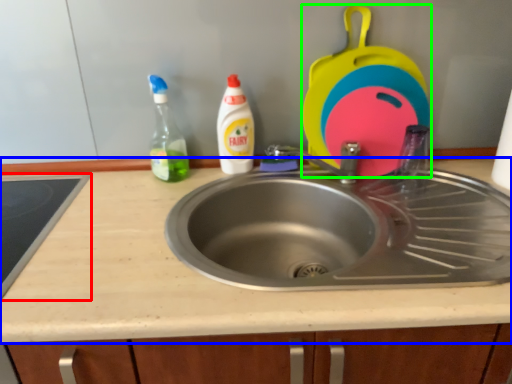
Question: Considering the real-world distances, which object is farthest from appliance (highlighted by a red box)? countertop (highlighted by a blue box) or appliance (highlighted by a green box)?

Choices:
 (A) countertop
 (B) appliance

Answer: (B)